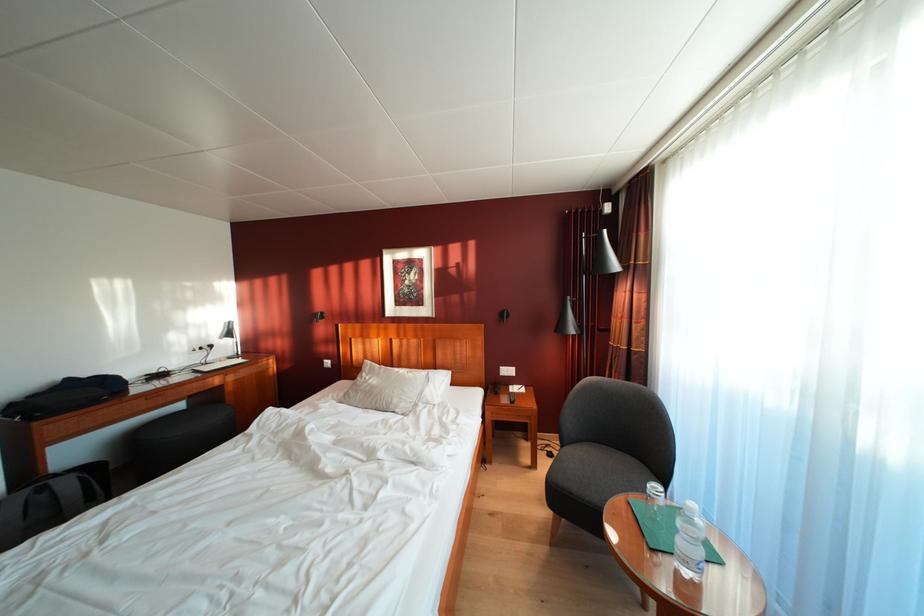
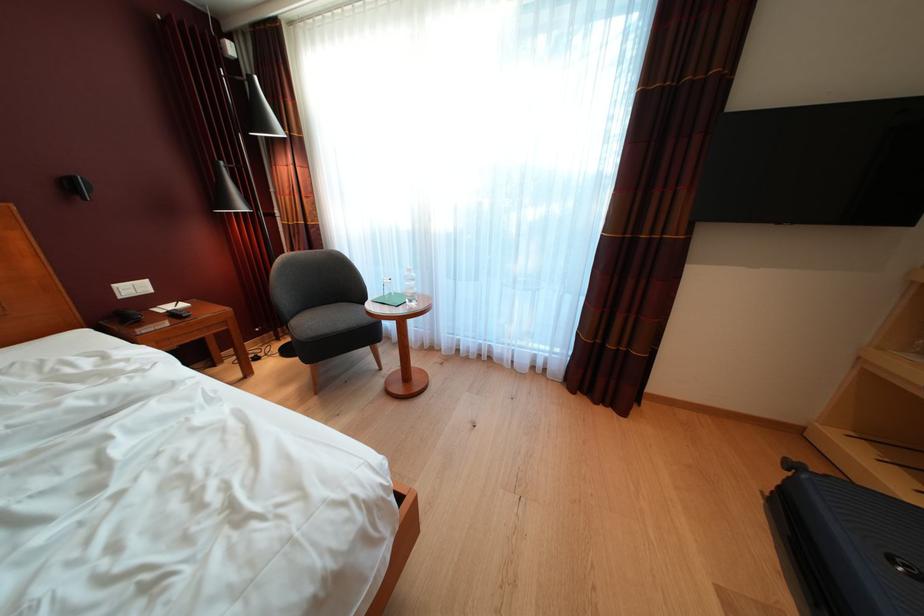
First-person continuous shooting, in which direction is the camera rotating?

The camera's rotation is toward right-down.